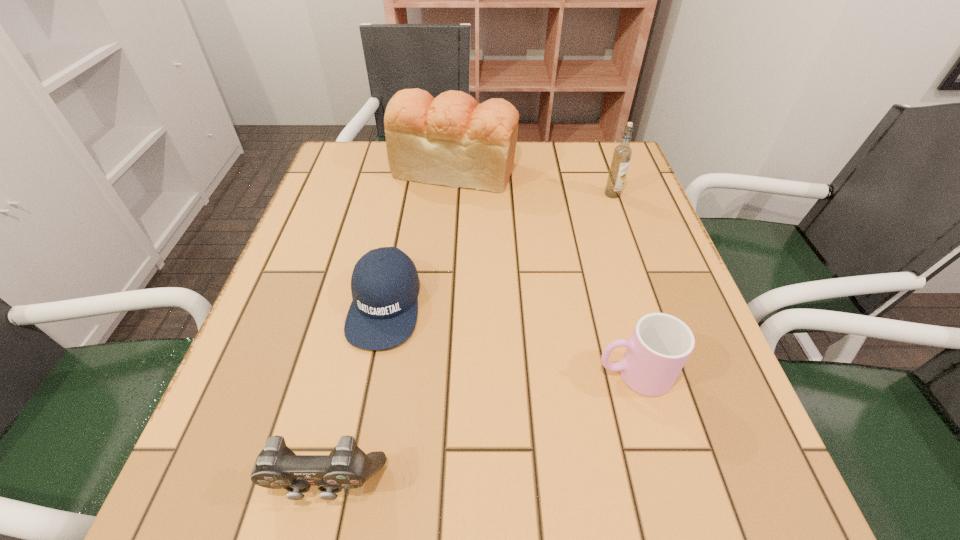
This screenshot has height=540, width=960. I want to click on free space located with the handle on the side of the fourth farthest object, so click(567, 374).

I want to click on free space located on the front-facing side of the baseball cap, so click(x=367, y=398).

Find the location of a particular element. The height and width of the screenshot is (540, 960). object that is at the far edge is located at coordinates (452, 140).

The width and height of the screenshot is (960, 540). I want to click on object that is at the near edge, so click(277, 467).

At what (x,y) coordinates should I click in order to perform the action: click on control that is at the left edge. Please return your answer as a coordinate pair (x, y). Looking at the image, I should click on (277, 467).

Where is `baseball cap that is at the left edge`? baseball cap that is at the left edge is located at coordinates (383, 313).

Identify the location of vodka at the right edge. (622, 153).

I want to click on cup located at the right edge, so click(x=660, y=345).

Locate an element on the screen. object that is at the near left corner is located at coordinates (277, 467).

Image resolution: width=960 pixels, height=540 pixels. Find the location of `vacant region at the left edge of the desktop`. vacant region at the left edge of the desktop is located at coordinates (312, 214).